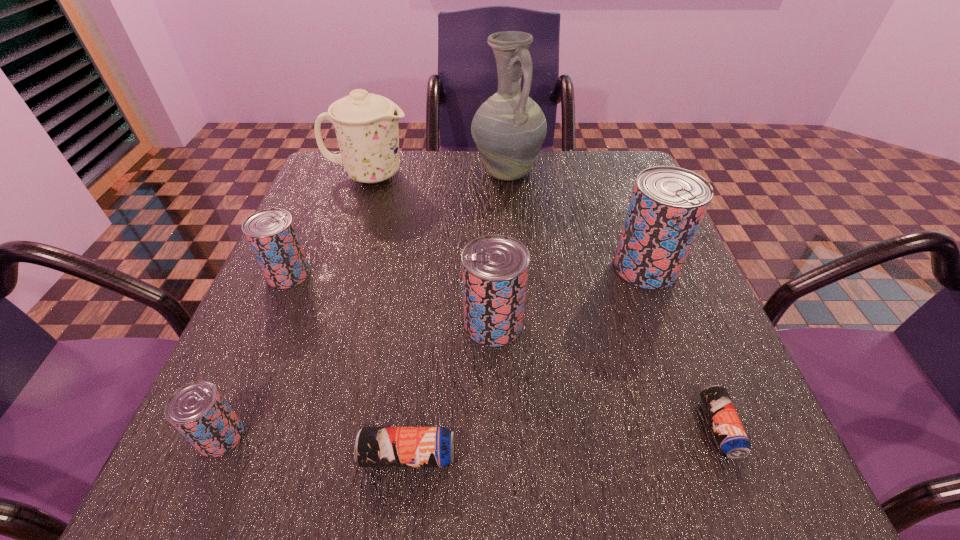
The width and height of the screenshot is (960, 540). What are the coordinates of `the left blue beer can` in the screenshot? It's located at (374, 446).

Locate an element on the screen. The height and width of the screenshot is (540, 960). the third beer can from left to right is located at coordinates (374, 446).

I want to click on the shortest object, so click(731, 436).

Find the location of `the shortest beer can`. the shortest beer can is located at coordinates (731, 436).

I want to click on vacant space located on the handle side of the pitcher, so click(x=513, y=249).

Identify the location of free space located on the spout of the chinaware. (489, 175).

This screenshot has width=960, height=540. What are the coordinates of `vacant region located on the front of the biggest red beer can` in the screenshot? It's located at (666, 322).

What are the coordinates of `free location located 0.080m on the left of the fourth nearest object` in the screenshot? It's located at (420, 323).

Where is `vacant space situated on the front of the fourth shortest object`? vacant space situated on the front of the fourth shortest object is located at coordinates (270, 318).

At what (x,y) coordinates should I click in order to perform the action: click on vacant space located 0.090m on the right of the smallest red beer can. Please return your answer as a coordinate pair (x, y). The width and height of the screenshot is (960, 540). Looking at the image, I should click on (304, 436).